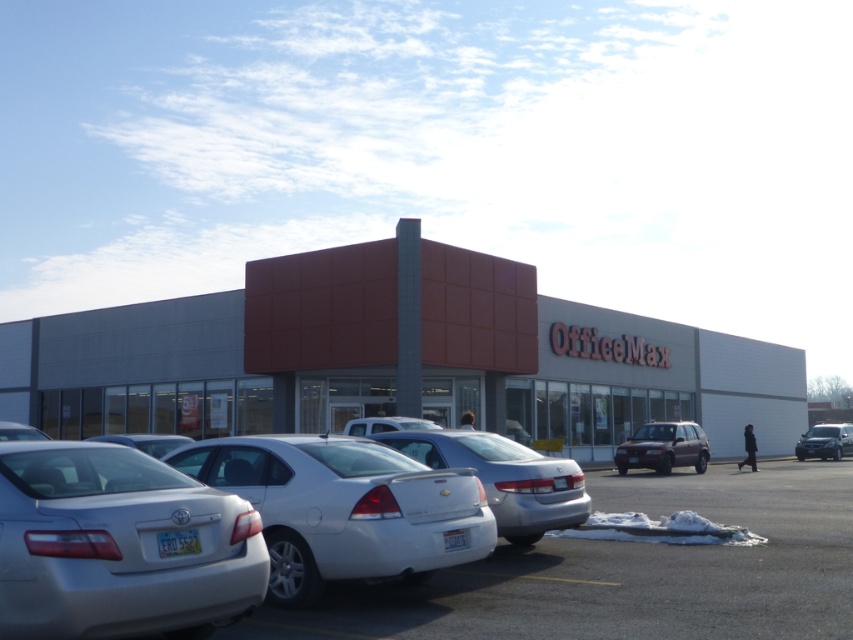
Question: Observing the image, what is the correct spatial positioning of satin silver sedan at center in reference to satin black suv at right?

Choices:
 (A) left
 (B) right

Answer: (A)

Question: In this image, where is silver metallic sedan at lower left located relative to satin silver sedan at center?

Choices:
 (A) above
 (B) below

Answer: (A)

Question: Which of the following is the farthest from the observer?

Choices:
 (A) (514, 508)
 (B) (117, 509)
 (C) (368, 413)

Answer: (C)

Question: Which point appears closest to the camera in this image?

Choices:
 (A) (334, 465)
 (B) (38, 566)
 (C) (830, 592)
 (D) (521, 500)

Answer: (B)

Question: Which point is farther to the camera?

Choices:
 (A) satin silver sedan at center
 (B) white matte car at center
 (C) metallic silver car at lower left

Answer: (B)

Question: Does red textured building at center lie behind silver metallic sedan at lower left?

Choices:
 (A) yes
 (B) no

Answer: (A)